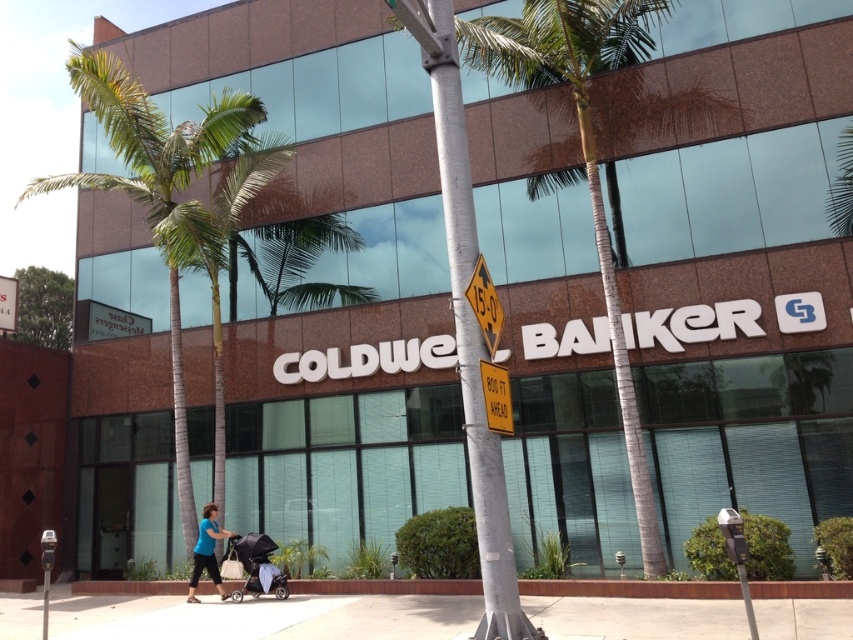
Looking at this image, you are a delivery person trying to park your bike. The bike requires a space that is taller than the blue fabric stroller at lower center. Can you park your bike on the concrete at center?

The concrete at center is much taller than the blue fabric stroller at lower center, so yes, the bike can be parked there as it meets the height requirement.

You are standing on the sidewalk and see the concrete at center and the green leafy palm tree at left. Which object is closer to your right side?

The concrete at center is positioned on the right side of green leafy palm tree at left, so the concrete at center is closer to your right side.

You are standing at the point marked by the coordinates point (165, 189) in the image. What can you see in the direction of the building?

The point (165, 189) indicates a green leafy palm tree at left, so in the direction of the building, you would see the modern commercial building with large glass windows reflecting the sky and surrounding palm trees, as described in the scene.